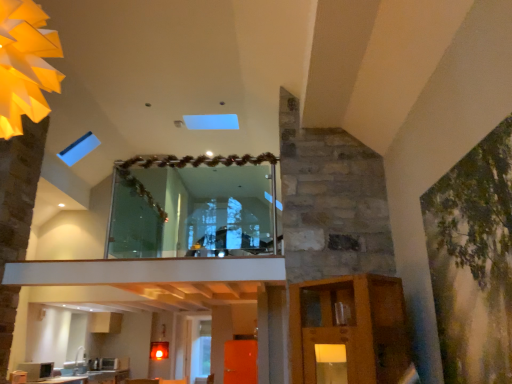
Where is `white glossy countertop at lower left`? Image resolution: width=512 pixels, height=384 pixels. white glossy countertop at lower left is located at coordinates (90, 378).

The height and width of the screenshot is (384, 512). What do you see at coordinates (193, 206) in the screenshot? I see `transparent glass window at center` at bounding box center [193, 206].

The image size is (512, 384). Describe the element at coordinates (197, 348) in the screenshot. I see `transparent glass door at center` at that location.

The image size is (512, 384). Describe the element at coordinates (37, 370) in the screenshot. I see `matte black microwave at lower left` at that location.

This screenshot has height=384, width=512. I want to click on green matte painting at right, so click(476, 208).

Is transparent glass door at center looking in the opposite direction of matte yellow paper light at upper left?

transparent glass door at center does not have its back to matte yellow paper light at upper left.

Is point (196, 346) closer or farther from the camera than point (15, 31)?

Point (196, 346) appears to be farther away from the viewer than point (15, 31).

How different are the orientations of transparent glass door at center and matte yellow paper light at upper left in degrees?

The angular difference between transparent glass door at center and matte yellow paper light at upper left is 179 degrees.

Locate an element on the screen. The image size is (512, 384). appliance that is above the white glossy countertop at lower left (from the image's perspective) is located at coordinates (37, 370).

From the image's perspective, between matte black microwave at lower left and white glossy countertop at lower left, which one is located above?

From the image's view, matte black microwave at lower left is above.

Which is in front, matte black microwave at lower left or white glossy countertop at lower left?

Positioned in front is matte black microwave at lower left.

In the scene shown: Would you say matte yellow paper light at upper left is outside matte black microwave at lower left?

Yes, matte yellow paper light at upper left is outside of matte black microwave at lower left.

In the scene shown: Is matte yellow paper light at upper left oriented towards matte black microwave at lower left?

No, matte yellow paper light at upper left is not turned towards matte black microwave at lower left.

In the scene shown: Which object is further away from the camera taking this photo, matte yellow paper light at upper left or matte black microwave at lower left?

matte black microwave at lower left is further from the camera.

From a real-world perspective, between matte yellow paper light at upper left and matte black microwave at lower left, who is vertically higher?

From a 3D spatial view, matte yellow paper light at upper left is above.

Is matte yellow paper light at upper left next to transparent glass door at center?

No, matte yellow paper light at upper left is not touching transparent glass door at center.

Is matte yellow paper light at upper left positioned with its back to transparent glass door at center?

No, matte yellow paper light at upper left is not facing the opposite direction of transparent glass door at center.

From the image's perspective, which one is positioned higher, matte yellow paper light at upper left or transparent glass door at center?

From the image's view, matte yellow paper light at upper left is above.

Can you tell me how much white glossy countertop at lower left and transparent glass door at center differ in facing direction?

89.8 degrees separate the facing orientations of white glossy countertop at lower left and transparent glass door at center.

From a real-world perspective, which object stands above the other?

From a 3D spatial view, transparent glass door at center is above.

Is white glossy countertop at lower left at the left side of transparent glass door at center?

Indeed, white glossy countertop at lower left is positioned on the left side of transparent glass door at center.

Can you confirm if white glossy countertop at lower left is wider than transparent glass door at center?

Yes, white glossy countertop at lower left is wider than transparent glass door at center.

How different are the orientations of transparent glass door at center and white glossy countertop at lower left in degrees?

There is a 89.8-degree angle between the facing directions of transparent glass door at center and white glossy countertop at lower left.

Is white glossy countertop at lower left surrounded by transparent glass door at center?

No.

Where is `glass door below the white glossy countertop at lower left (from the image's perspective)`? The width and height of the screenshot is (512, 384). glass door below the white glossy countertop at lower left (from the image's perspective) is located at coordinates (197, 348).

From a real-world perspective, is transparent glass door at center located beneath white glossy countertop at lower left?

No, from a real-world perspective, transparent glass door at center is not under white glossy countertop at lower left.

Is transparent glass window at center inside the boundaries of green matte painting at right, or outside?

transparent glass window at center is not inside green matte painting at right, it's outside.

Does transparent glass window at center have a smaller size compared to green matte painting at right?

No, transparent glass window at center is not smaller than green matte painting at right.

Measure the distance between transparent glass window at center and green matte painting at right.

A distance of 9.66 feet exists between transparent glass window at center and green matte painting at right.

Locate an element on the screen. Image resolution: width=512 pixels, height=384 pixels. plant below the transparent glass window at center (from the image's perspective) is located at coordinates tap(476, 208).

Where is `lighting in front of the transparent glass door at center`? The image size is (512, 384). lighting in front of the transparent glass door at center is located at coordinates (25, 64).

Identify the location of appliance to the left of white glossy countertop at lower left. (x=37, y=370).

Based on their spatial positions, is white glossy countertop at lower left or matte black microwave at lower left closer to matte yellow paper light at upper left?

matte black microwave at lower left is positioned closer to the anchor matte yellow paper light at upper left.

When comparing their distances from green matte painting at right, does white glossy countertop at lower left or matte black microwave at lower left seem further?

Among the two, white glossy countertop at lower left is located further to green matte painting at right.

Which object lies further to the anchor point matte yellow paper light at upper left, green matte painting at right or transparent glass door at center?

Based on the image, transparent glass door at center appears to be further to matte yellow paper light at upper left.

Based on their spatial positions, is white glossy countertop at lower left or transparent glass window at center closer to matte yellow paper light at upper left?

transparent glass window at center.

Based on their spatial positions, is transparent glass door at center or green matte painting at right further from white glossy countertop at lower left?

Based on the image, green matte painting at right appears to be further to white glossy countertop at lower left.

Which object lies further to the anchor point green matte painting at right, white glossy countertop at lower left or matte yellow paper light at upper left?

white glossy countertop at lower left is further to green matte painting at right.

Estimate the real-world distances between objects in this image. Which object is closer to transparent glass door at center, green matte painting at right or matte black microwave at lower left?

Among the two, matte black microwave at lower left is located nearer to transparent glass door at center.

Estimate the real-world distances between objects in this image. Which object is closer to transparent glass window at center, matte black microwave at lower left or green matte painting at right?

Among the two, green matte painting at right is located nearer to transparent glass window at center.

I want to click on appliance positioned between transparent glass window at center and transparent glass door at center from near to far, so click(37, 370).

This screenshot has width=512, height=384. In order to click on counter top between matte yellow paper light at upper left and transparent glass door at center in the front-back direction in this screenshot , I will do `click(90, 378)`.

The width and height of the screenshot is (512, 384). I want to click on window between green matte painting at right and matte black microwave at lower left from front to back, so click(x=193, y=206).

Locate an element on the screen. The width and height of the screenshot is (512, 384). window between green matte painting at right and transparent glass door at center along the z-axis is located at coordinates (193, 206).